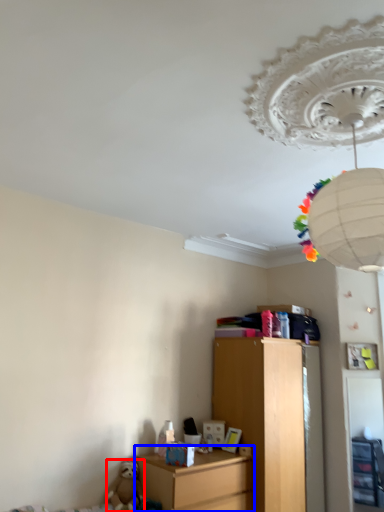
Question: Among these objects, which one is farthest to the camera, toy (highlighted by a red box) or nightstand (highlighted by a blue box)?

Choices:
 (A) toy
 (B) nightstand

Answer: (A)